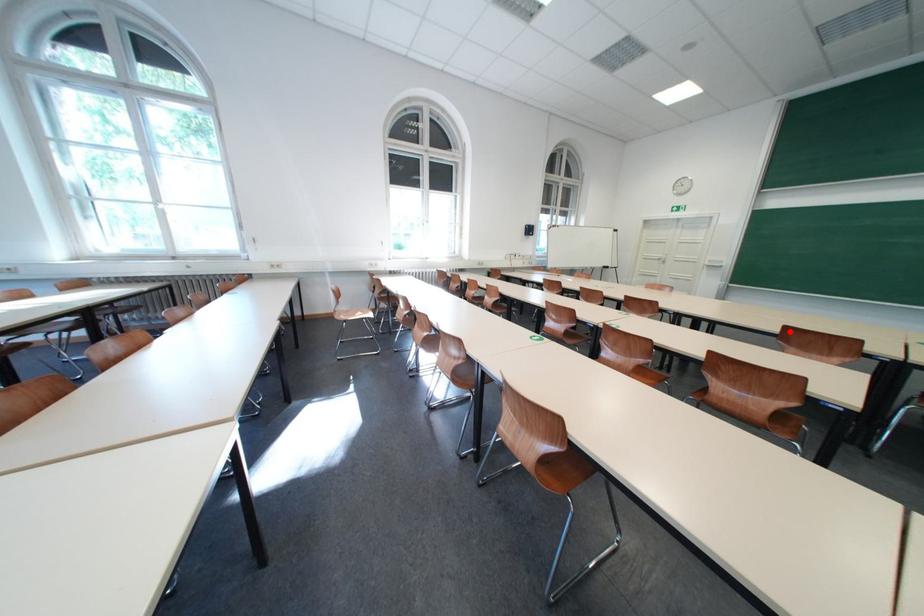
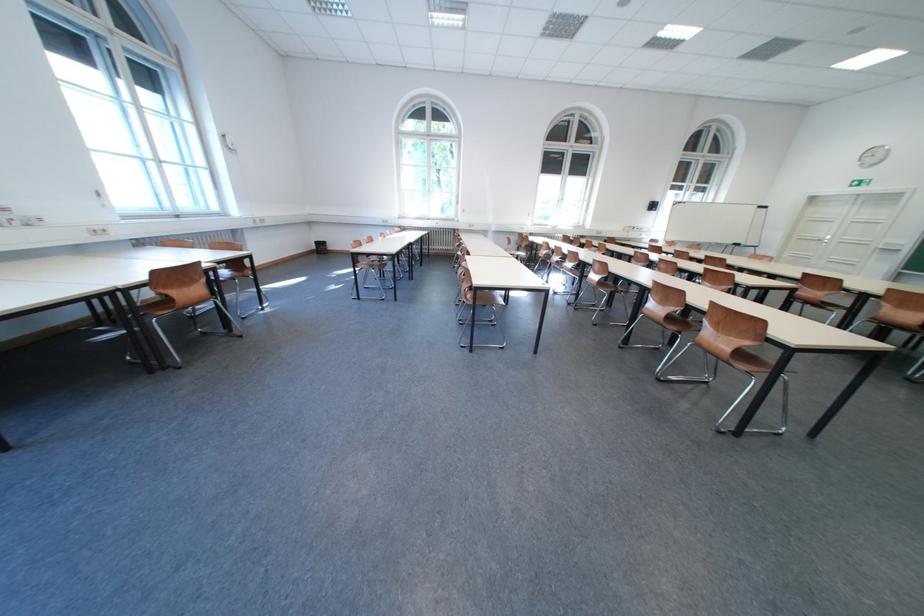
Find the pixel in the second image that matches the highlighted location in the first image.

(813, 278)